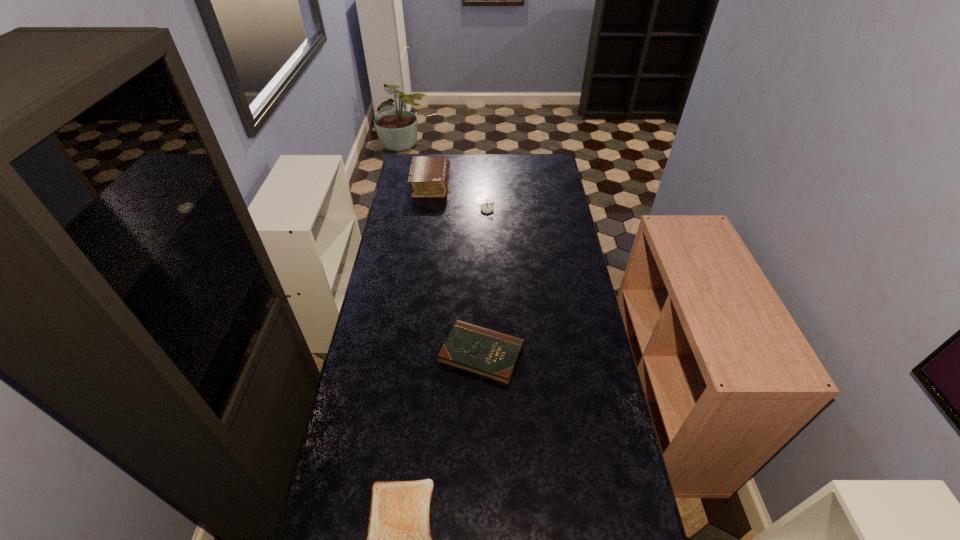
Where is `object that is at the left edge`? Image resolution: width=960 pixels, height=540 pixels. object that is at the left edge is located at coordinates (429, 175).

In order to click on object present at the far left corner in this screenshot , I will do `click(429, 175)`.

Where is `vacant space at the far edge of the desktop`? vacant space at the far edge of the desktop is located at coordinates tap(492, 168).

In the image, there is a desktop. Where is `free space at the left edge`? free space at the left edge is located at coordinates (382, 303).

Where is `vacant area at the right edge`? The image size is (960, 540). vacant area at the right edge is located at coordinates (594, 343).

Find the location of a particular element. free area in between the farthest object and the compass is located at coordinates [459, 197].

The width and height of the screenshot is (960, 540). Identify the location of vacant space in between the second farthest object and the second nearest object. (484, 281).

Where is `unoccupied position between the compass and the taller Bible`? The width and height of the screenshot is (960, 540). unoccupied position between the compass and the taller Bible is located at coordinates (459, 197).

Identify the location of unoccupied area between the third farthest object and the farther Bible. The image size is (960, 540). click(456, 269).

Identify which object is the closest to the right Bible. Please provide its 2D coordinates. Your answer should be formatted as a tuple, i.e. [(x, y)], where the tuple contains the x and y coordinates of a point satisfying the conditions above.

[(398, 539)]